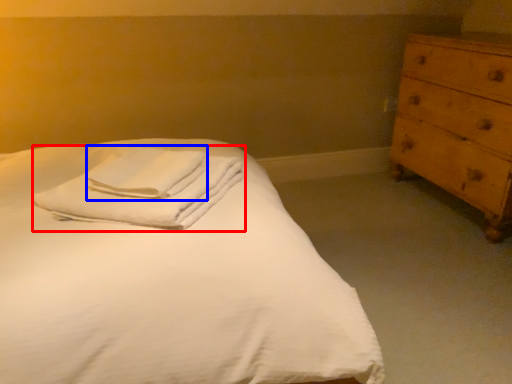
Question: Which object appears farthest to the camera in this image, material (highlighted by a red box) or bath towel (highlighted by a blue box)?

Choices:
 (A) material
 (B) bath towel

Answer: (B)